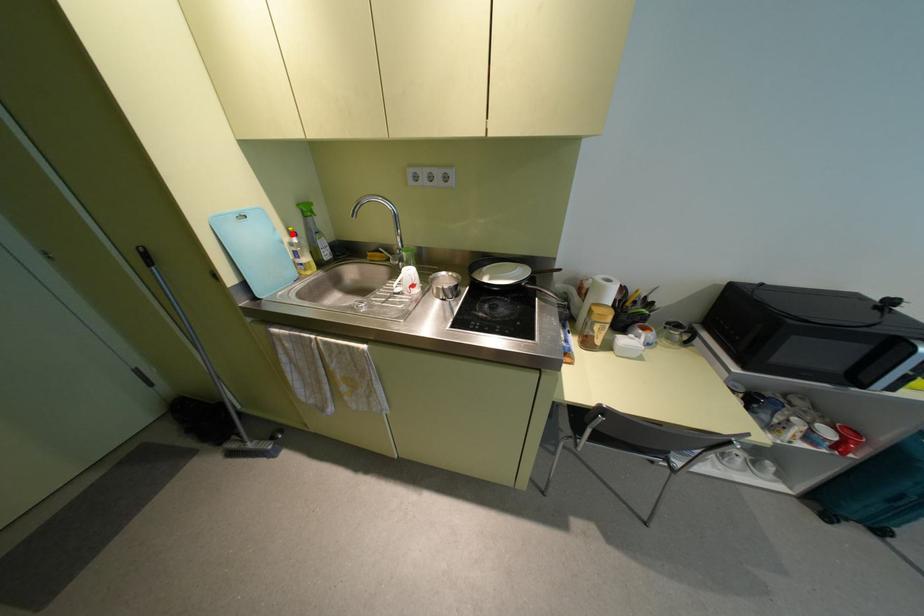
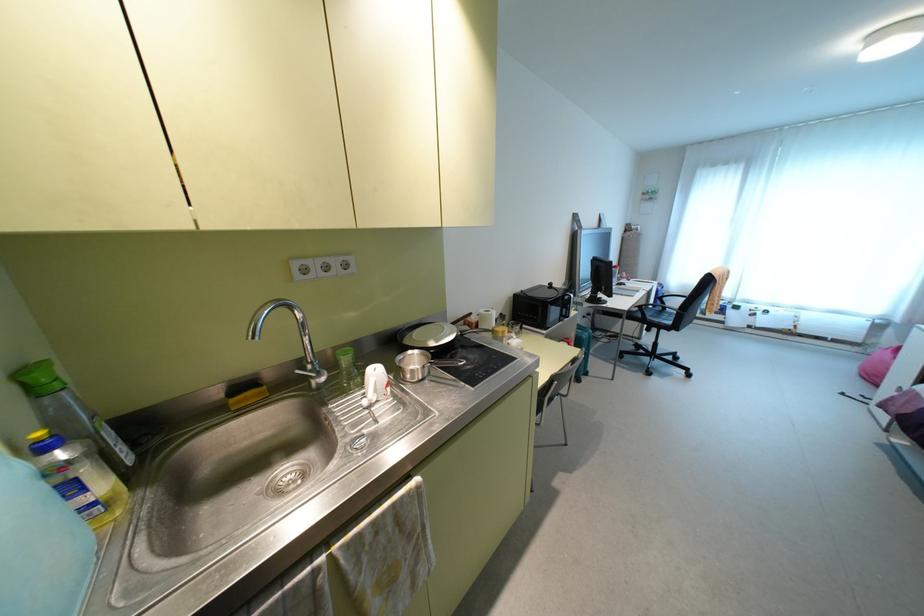
In the second image, find the point that corresponds to the highlighted location in the first image.

(43, 447)